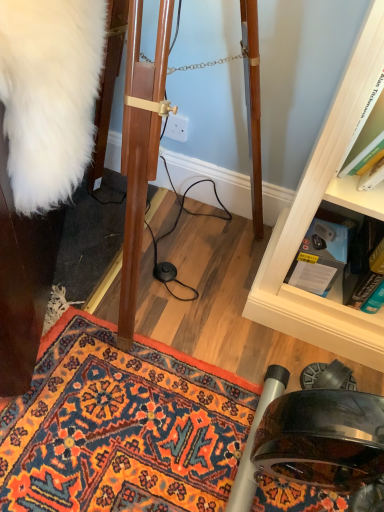
Question: Is carpeted doormat at lower left in front of or behind white fluffy coat at left in the image?

Choices:
 (A) behind
 (B) front

Answer: (A)

Question: Based on their positions, is carpeted doormat at lower left located to the left or right of white fluffy coat at left?

Choices:
 (A) right
 (B) left

Answer: (A)

Question: Which is farther from the carpeted doormat at lower left?

Choices:
 (A) white plastic power outlet at center
 (B) white fluffy coat at left
 (C) hardcover book at lower right, which is the second book in left-to-right order
 (D) blue cardboard box at lower right, acting as the second book starting from the right

Answer: (A)

Question: Based on their relative distances, which object is farther from the white plastic power outlet at center?

Choices:
 (A) hardcover book at lower right, the first book viewed from the right
 (B) carpeted doormat at lower left
 (C) white fluffy coat at left
 (D) blue cardboard box at lower right, marked as the 1th book in a left-to-right arrangement

Answer: (B)